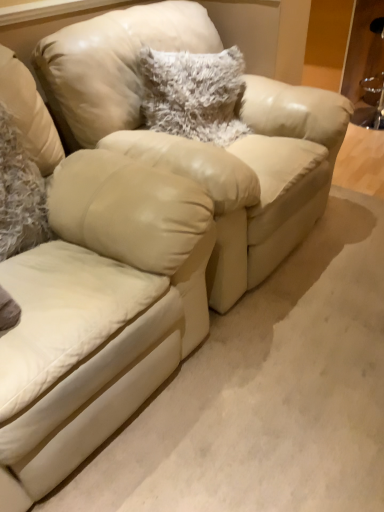
What is the approximate width of fuzzy white pillow at center, which is counted as the second pillow, starting from the front?

fuzzy white pillow at center, which is counted as the second pillow, starting from the front, is 10.96 inches in width.

Locate an element on the screen. matte leather swivel chair at center is located at coordinates (98, 313).

From a real-world perspective, who is located higher, fuzzy white pillow at center, positioned as the first pillow in back-to-front order, or matte leather swivel chair at center?

fuzzy white pillow at center, positioned as the first pillow in back-to-front order.

How different are the orientations of fuzzy white pillow at center, the 1th pillow from the right, and matte leather swivel chair at center in degrees?

10.6 degrees separate the facing orientations of fuzzy white pillow at center, the 1th pillow from the right, and matte leather swivel chair at center.

Does fuzzy white pillow at center, which is counted as the second pillow, starting from the front, have a greater height compared to matte leather swivel chair at center?

No, fuzzy white pillow at center, which is counted as the second pillow, starting from the front, is not taller than matte leather swivel chair at center.

Can you tell me how much fuzzy white pillow at center, the 1th pillow from the right, and fuzzy white pillow at left, positioned as the first pillow in left-to-right order, differ in facing direction?

7.83 degrees.

In the image, is fuzzy white pillow at center, acting as the second pillow starting from the left, positioned in front of or behind fuzzy white pillow at left, which is the second pillow from back to front?

Visually, fuzzy white pillow at center, acting as the second pillow starting from the left, is located behind fuzzy white pillow at left, which is the second pillow from back to front.

From the image's perspective, does fuzzy white pillow at center, which is counted as the second pillow, starting from the front, appear lower than fuzzy white pillow at left, which is the second pillow from back to front?

Actually, fuzzy white pillow at center, which is counted as the second pillow, starting from the front, appears above fuzzy white pillow at left, which is the second pillow from back to front, in the image.

Considering the positions of objects fuzzy white pillow at left, positioned as the first pillow in left-to-right order, and fuzzy white pillow at center, positioned as the first pillow in back-to-front order, in the image provided, who is more to the left, fuzzy white pillow at left, positioned as the first pillow in left-to-right order, or fuzzy white pillow at center, positioned as the first pillow in back-to-front order,?

fuzzy white pillow at left, positioned as the first pillow in left-to-right order.

In the scene shown: Which object is further away from the camera taking this photo, fuzzy white pillow at left, which is the second pillow from back to front, or fuzzy white pillow at center, which is counted as the second pillow, starting from the front?

fuzzy white pillow at center, which is counted as the second pillow, starting from the front, is more distant.

Is fuzzy white pillow at center, positioned as the first pillow in back-to-front order, surrounded by fuzzy white pillow at left, which is the second pillow from back to front?

No, fuzzy white pillow at center, positioned as the first pillow in back-to-front order, is not inside fuzzy white pillow at left, which is the second pillow from back to front.

Is matte leather swivel chair at center to the left of fuzzy white pillow at center, which is counted as the second pillow, starting from the front, from the viewer's perspective?

Correct, you'll find matte leather swivel chair at center to the left of fuzzy white pillow at center, which is counted as the second pillow, starting from the front.

From a real-world perspective, which is physically above, matte leather swivel chair at center or fuzzy white pillow at center, acting as the second pillow starting from the left?

fuzzy white pillow at center, acting as the second pillow starting from the left, is physically above.

From the image's perspective, between matte leather swivel chair at center and fuzzy white pillow at center, positioned as the first pillow in back-to-front order, which one is located above?

From the image's view, fuzzy white pillow at center, positioned as the first pillow in back-to-front order, is above.

Does matte leather swivel chair at center have a larger size compared to fuzzy white pillow at center, the 1th pillow from the right?

Correct, matte leather swivel chair at center is larger in size than fuzzy white pillow at center, the 1th pillow from the right.

From a real-world perspective, who is located higher, matte leather swivel chair at center or fuzzy white pillow at left, positioned as the first pillow in left-to-right order?

fuzzy white pillow at left, positioned as the first pillow in left-to-right order, from a real-world perspective.

From the picture: Does matte leather swivel chair at center contain fuzzy white pillow at left, which is the second pillow from back to front?

Yes, fuzzy white pillow at left, which is the second pillow from back to front, is surrounded by matte leather swivel chair at center.

Considering the sizes of objects matte leather swivel chair at center and fuzzy white pillow at left, the second pillow from the right, in the image provided, who is wider, matte leather swivel chair at center or fuzzy white pillow at left, the second pillow from the right,?

With larger width is matte leather swivel chair at center.

From the image's perspective, is matte leather swivel chair at center under fuzzy white pillow at left, which is the 1th pillow in front-to-back order?

Yes, from the image's perspective, matte leather swivel chair at center is beneath fuzzy white pillow at left, which is the 1th pillow in front-to-back order.

Looking at their sizes, would you say fuzzy white pillow at left, the second pillow from the right, is wider or thinner than matte leather swivel chair at center?

fuzzy white pillow at left, the second pillow from the right, is thinner than matte leather swivel chair at center.

Are fuzzy white pillow at left, positioned as the first pillow in left-to-right order, and matte leather swivel chair at center beside each other?

No, fuzzy white pillow at left, positioned as the first pillow in left-to-right order, is not touching matte leather swivel chair at center.

Is fuzzy white pillow at left, which is the 1th pillow in front-to-back order, smaller than matte leather swivel chair at center?

Indeed, fuzzy white pillow at left, which is the 1th pillow in front-to-back order, has a smaller size compared to matte leather swivel chair at center.

Does fuzzy white pillow at left, the second pillow from the right, appear on the right side of matte leather swivel chair at center?

No.

From the image's perspective, count 2nd pillows upward from the matte leather swivel chair at center and point to it. Please provide its 2D coordinates.

[(194, 94)]

At what (x,y) coordinates should I click in order to perform the action: click on pillow located below the fuzzy white pillow at center, acting as the second pillow starting from the left (from the image's perspective). Please return your answer as a coordinate pair (x, y). This screenshot has height=512, width=384. Looking at the image, I should click on (19, 193).

From the image, which object appears to be farther from matte leather swivel chair at center, fuzzy white pillow at center, which is counted as the second pillow, starting from the front, or fuzzy white pillow at left, positioned as the first pillow in left-to-right order?

fuzzy white pillow at center, which is counted as the second pillow, starting from the front, is positioned further to the anchor matte leather swivel chair at center.

Which object lies further to the anchor point fuzzy white pillow at center, acting as the second pillow starting from the left, fuzzy white pillow at left, positioned as the first pillow in left-to-right order, or matte leather swivel chair at center?

matte leather swivel chair at center is further to fuzzy white pillow at center, acting as the second pillow starting from the left.

Which object lies nearer to the anchor point matte leather swivel chair at center, fuzzy white pillow at left, positioned as the first pillow in left-to-right order, or fuzzy white pillow at center, acting as the second pillow starting from the left?

The object closer to matte leather swivel chair at center is fuzzy white pillow at left, positioned as the first pillow in left-to-right order.

Which object lies nearer to the anchor point fuzzy white pillow at left, the second pillow from the right, matte leather swivel chair at center or fuzzy white pillow at center, positioned as the first pillow in back-to-front order?

Based on the image, matte leather swivel chair at center appears to be nearer to fuzzy white pillow at left, the second pillow from the right.

Which object lies further to the anchor point fuzzy white pillow at left, the second pillow from the right, fuzzy white pillow at center, positioned as the first pillow in back-to-front order, or matte leather swivel chair at center?

fuzzy white pillow at center, positioned as the first pillow in back-to-front order, is further to fuzzy white pillow at left, the second pillow from the right.

From the image, which object appears to be farther from fuzzy white pillow at center, acting as the second pillow starting from the left, matte leather swivel chair at center or fuzzy white pillow at left, which is the second pillow from back to front?

Based on the image, matte leather swivel chair at center appears to be further to fuzzy white pillow at center, acting as the second pillow starting from the left.

Find the location of `pillow between matte leather swivel chair at center and fuzzy white pillow at center, positioned as the first pillow in back-to-front order, along the z-axis`. pillow between matte leather swivel chair at center and fuzzy white pillow at center, positioned as the first pillow in back-to-front order, along the z-axis is located at coordinates (19, 193).